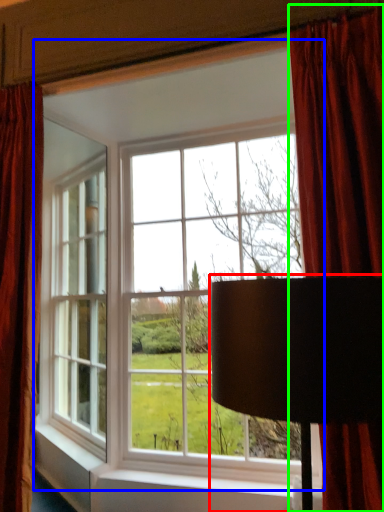
Question: Estimate the real-world distances between objects in this image. Which object is farther from table lamp (highlighted by a red box), window (highlighted by a blue box) or curtain (highlighted by a green box)?

Choices:
 (A) window
 (B) curtain

Answer: (A)